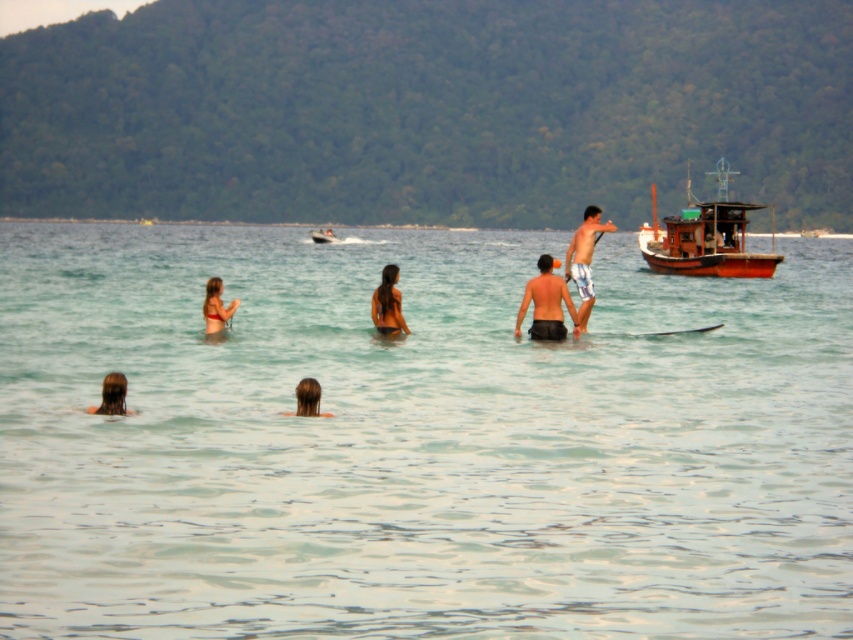
Between wooden boat at right and dark skin human at center, which one is positioned higher?

wooden boat at right is above.

Is wooden boat at right in front of dark skin human at center?

No, wooden boat at right is further to the viewer.

Locate an element on the screen. wooden boat at right is located at coordinates (706, 237).

At what (x,y) coordinates should I click in order to perform the action: click on wooden boat at right. Please return your answer as a coordinate pair (x, y). The height and width of the screenshot is (640, 853). Looking at the image, I should click on (706, 237).

Does light blue striped shorts at center have a greater width compared to matte bikini at center?

Correct, the width of light blue striped shorts at center exceeds that of matte bikini at center.

Is light blue striped shorts at center smaller than matte bikini at center?

Incorrect, light blue striped shorts at center is not smaller in size than matte bikini at center.

Between point (589, 314) and point (212, 296), which one is positioned in front?

Point (212, 296) is in front.

Locate an element on the screen. The width and height of the screenshot is (853, 640). light blue striped shorts at center is located at coordinates (584, 260).

Does wooden boat at right come in front of blonde hair at lower left?

No, it is not.

What do you see at coordinates (706, 237) in the screenshot? The width and height of the screenshot is (853, 640). I see `wooden boat at right` at bounding box center [706, 237].

You are a GUI agent. You are given a task and a screenshot of the screen. Output one action in this format:
    pyautogui.click(x=<x>, y=<y>)
    Task: Click on the wooden boat at right
    The height and width of the screenshot is (640, 853).
    Given the screenshot: What is the action you would take?
    pyautogui.click(x=706, y=237)